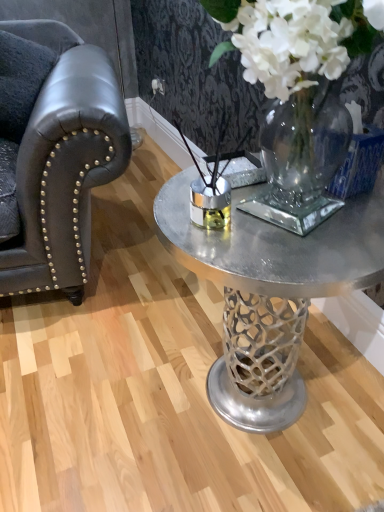
You are a GUI agent. You are given a task and a screenshot of the screen. Output one action in this format:
    pyautogui.click(x=<x>, y=<y>)
    Task: Click on the free point below clear glass vase at center (from a real-world perspective)
    The height and width of the screenshot is (512, 384).
    Given the screenshot: What is the action you would take?
    pyautogui.click(x=304, y=233)